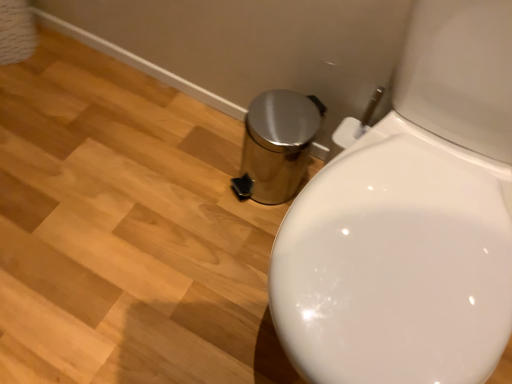
At what (x,y) coordinates should I click in order to perform the action: click on free point to the left of satin chrome bidet at lower right. Please return your answer as a coordinate pair (x, y). This screenshot has width=512, height=384. Looking at the image, I should click on (161, 242).